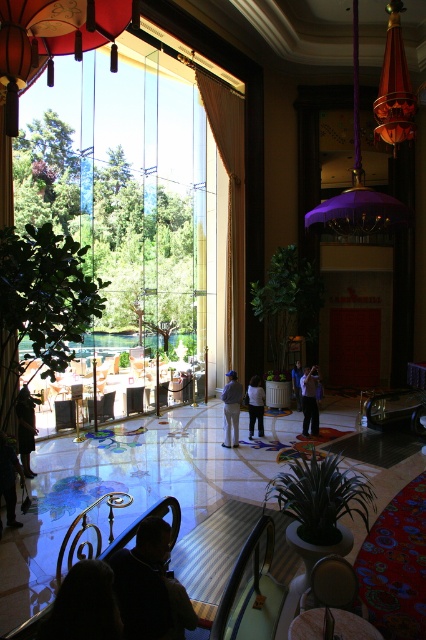
Question: Observing the image, what is the correct spatial positioning of dark fabric jacket at lower center in reference to dark blue jeans at lower left?

Choices:
 (A) left
 (B) right

Answer: (B)

Question: Does dark fabric at lower center appear on the left side of light blue fabric pants at center?

Choices:
 (A) yes
 (B) no

Answer: (A)

Question: Can you confirm if dark fabric at lower center is positioned to the left of light blue jeans at center?

Choices:
 (A) no
 (B) yes

Answer: (B)

Question: Which point is closer to the camera?

Choices:
 (A) light blue fabric pants at center
 (B) dark fabric jacket at lower center
 (C) dark brown leather jacket at lower left

Answer: (B)

Question: Which object is closer to the camera taking this photo?

Choices:
 (A) dark fabric jacket at lower center
 (B) light blue shirt at center
 (C) light blue fabric pants at center

Answer: (A)

Question: Which point is farther from the camera taking this photo?

Choices:
 (A) (11, 508)
 (B) (94, 588)

Answer: (A)